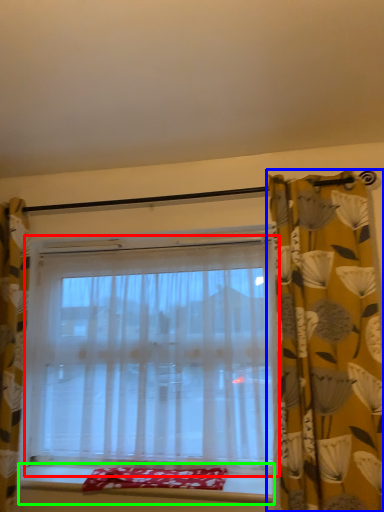
Question: Which object is positioned farthest from window (highlighted by a red box)? Select from curtain (highlighted by a blue box) and window sill (highlighted by a green box).

Choices:
 (A) curtain
 (B) window sill

Answer: (A)